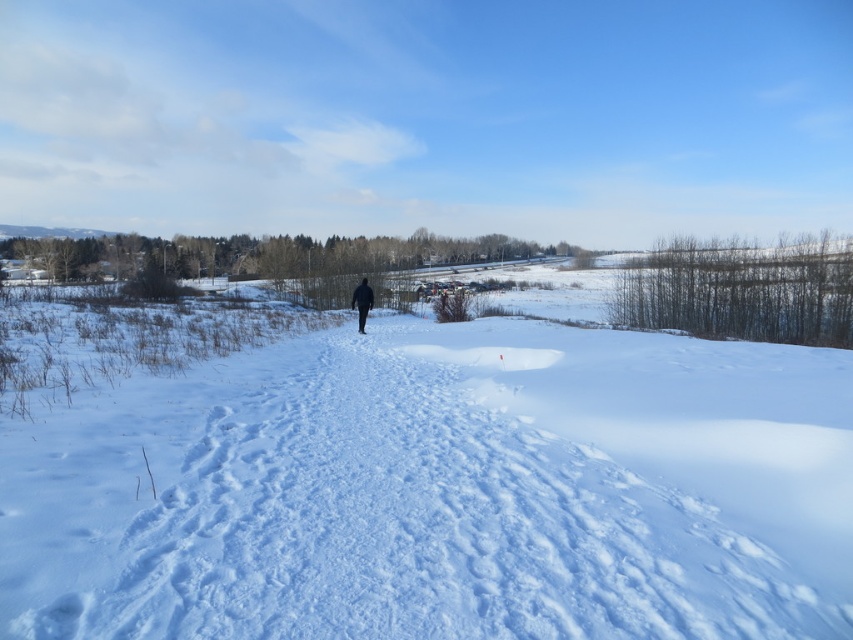
Does white fluffy snow at center appear under dark blue jacket at center?

Correct, white fluffy snow at center is located below dark blue jacket at center.

Between white fluffy snow at center and dark blue jacket at center, which one appears on the right side from the viewer's perspective?

Positioned to the right is white fluffy snow at center.

Between point (401, 632) and point (366, 292), which one is positioned behind?

The point (366, 292) is more distant.

Find the location of a particular element. The width and height of the screenshot is (853, 640). white fluffy snow at center is located at coordinates (442, 492).